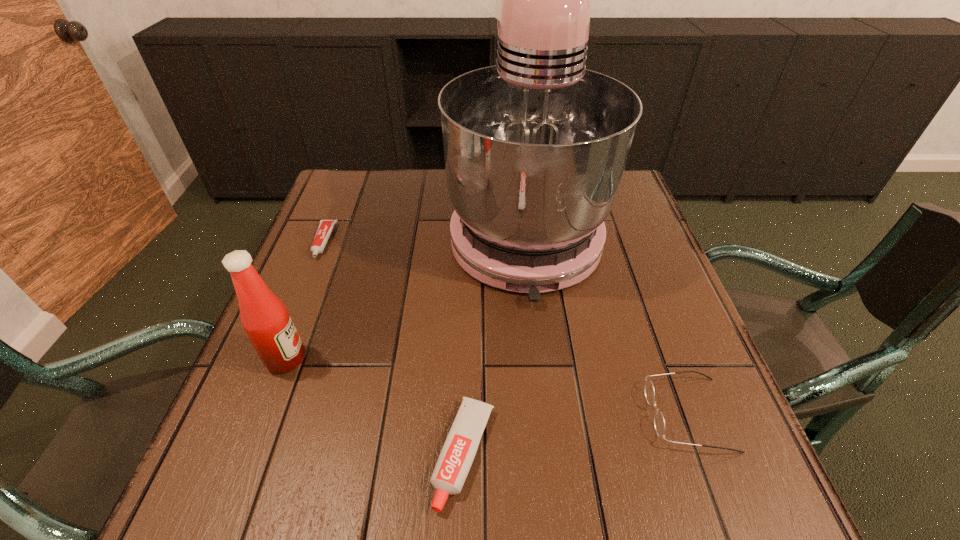
This screenshot has width=960, height=540. I want to click on the tallest object, so click(x=535, y=147).

Identify the location of the fourth shortest object. (265, 319).

In order to click on the third farthest object in this screenshot , I will do `click(265, 319)`.

Image resolution: width=960 pixels, height=540 pixels. In order to click on spectacles in this screenshot , I will do `click(659, 423)`.

Where is `the nearer toothpaste`? the nearer toothpaste is located at coordinates (458, 452).

Find the location of a particular element. the right toothpaste is located at coordinates (458, 452).

Identify the location of the farther toothpaste. Image resolution: width=960 pixels, height=540 pixels. (325, 228).

Where is `the left toothpaste`? the left toothpaste is located at coordinates (325, 228).

At what (x,y) coordinates should I click in order to perform the action: click on vacant space located 0.320m on the front-facing side of the mixer. Please return your answer as a coordinate pair (x, y). The height and width of the screenshot is (540, 960). Looking at the image, I should click on (550, 457).

Identify the location of free location located on the front-facing side of the condiment. (444, 359).